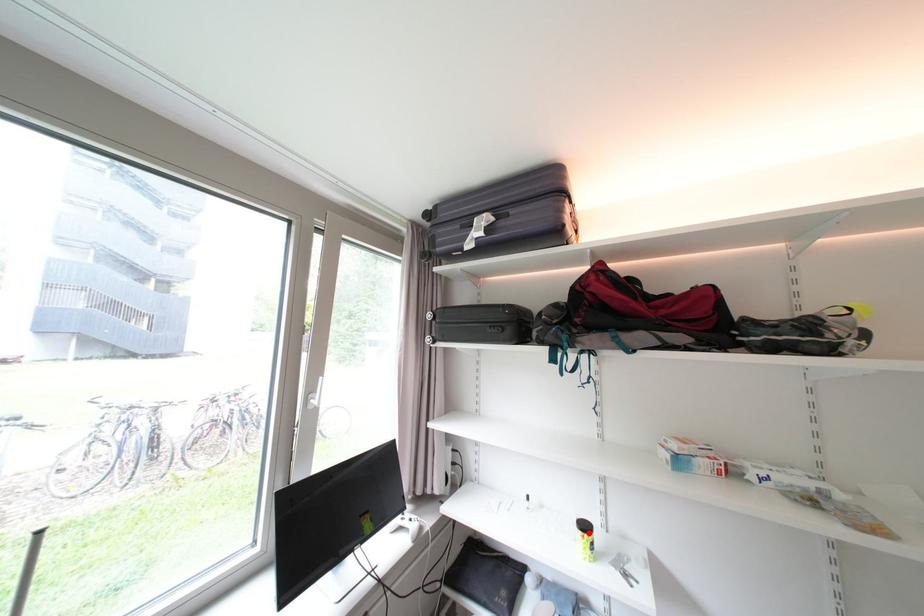
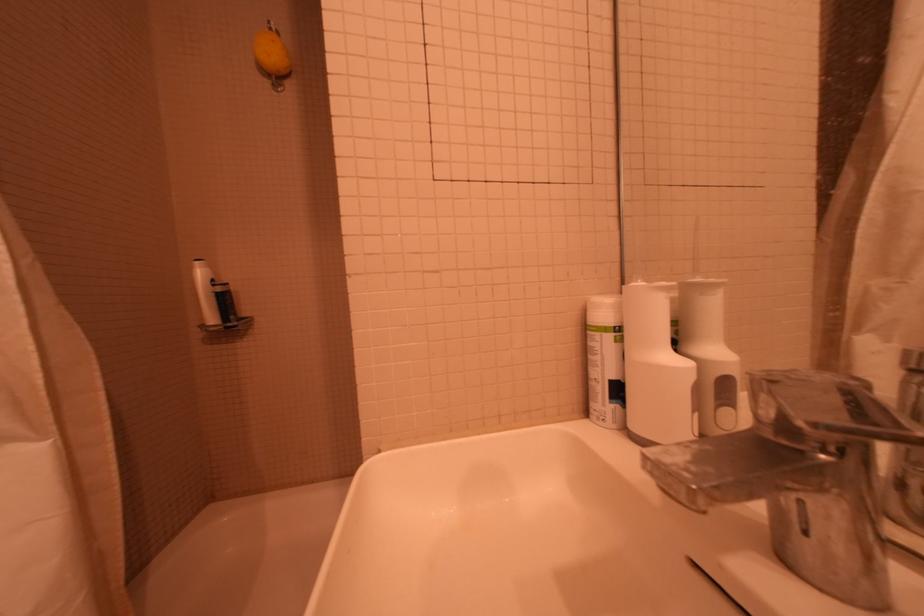
Question: I am providing you with two images of the same scene from different viewpoints. A red point is marked on the first image. Is the red point's position out of view in image 2?

Choices:
 (A) Yes
 (B) No

Answer: (A)